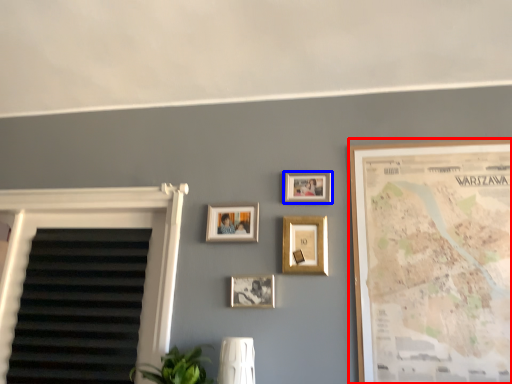
Question: Which object appears closest to the camera in this image, picture frame (highlighted by a red box) or picture frame (highlighted by a blue box)?

Choices:
 (A) picture frame
 (B) picture frame

Answer: (A)